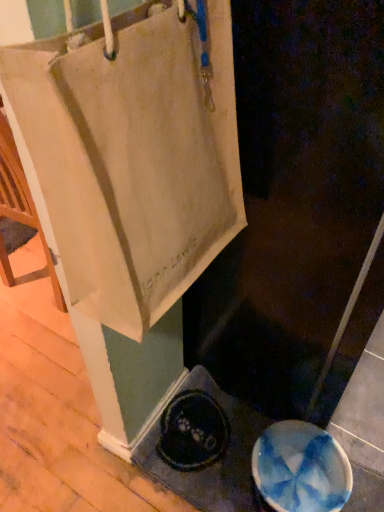
Question: Does blue glossy manhole cover at lower right have a lesser width compared to white canvas bag at upper left?

Choices:
 (A) yes
 (B) no

Answer: (A)

Question: Can you confirm if blue glossy manhole cover at lower right is positioned to the right of white canvas bag at upper left?

Choices:
 (A) no
 (B) yes

Answer: (A)

Question: From a real-world perspective, is blue glossy manhole cover at lower right beneath white canvas bag at upper left?

Choices:
 (A) yes
 (B) no

Answer: (A)

Question: Is blue glossy manhole cover at lower right bigger than white canvas bag at upper left?

Choices:
 (A) no
 (B) yes

Answer: (A)

Question: From the image's perspective, is blue glossy manhole cover at lower right located beneath white canvas bag at upper left?

Choices:
 (A) no
 (B) yes

Answer: (B)

Question: In terms of size, does beige canvas tote at upper left appear bigger or smaller than white canvas bag at upper left?

Choices:
 (A) small
 (B) big

Answer: (A)

Question: Considering the positions of beige canvas tote at upper left and white canvas bag at upper left in the image, is beige canvas tote at upper left taller or shorter than white canvas bag at upper left?

Choices:
 (A) tall
 (B) short

Answer: (B)

Question: Visually, is beige canvas tote at upper left positioned to the left or to the right of white canvas bag at upper left?

Choices:
 (A) left
 (B) right

Answer: (A)

Question: Looking at their shapes, would you say beige canvas tote at upper left is wider or thinner than white canvas bag at upper left?

Choices:
 (A) wide
 (B) thin

Answer: (B)

Question: Considering the positions of white canvas bag at upper left and blue glossy manhole cover at lower right in the image, is white canvas bag at upper left taller or shorter than blue glossy manhole cover at lower right?

Choices:
 (A) tall
 (B) short

Answer: (A)

Question: From the image's perspective, is white canvas bag at upper left located above or below blue glossy manhole cover at lower right?

Choices:
 (A) above
 (B) below

Answer: (A)

Question: Is point (228, 360) positioned closer to the camera than point (347, 466)?

Choices:
 (A) farther
 (B) closer

Answer: (A)

Question: From a real-world perspective, is white canvas bag at upper left positioned above or below blue glossy manhole cover at lower right?

Choices:
 (A) below
 (B) above

Answer: (B)

Question: From the image's perspective, is beige canvas tote at upper left located above or below blue glossy manhole cover at lower right?

Choices:
 (A) below
 (B) above

Answer: (B)

Question: In terms of height, does beige canvas tote at upper left look taller or shorter compared to blue glossy manhole cover at lower right?

Choices:
 (A) short
 (B) tall

Answer: (B)